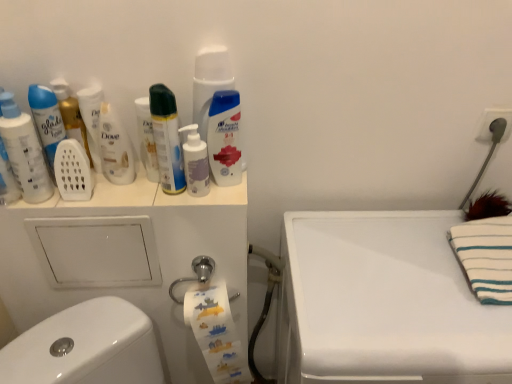
Identify the location of free space to the left of translucent plastic mouthwash at center, the 3th mouthwash positioned from the right. The image size is (512, 384). (121, 197).